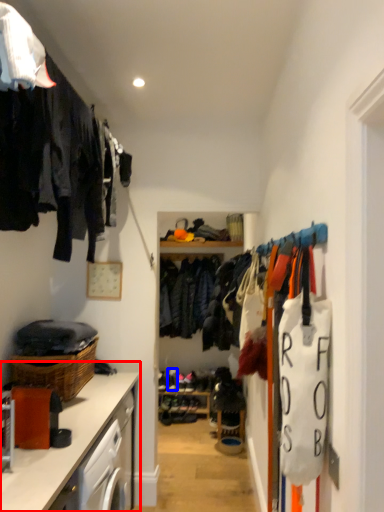
Question: Among these objects, which one is farthest to the camera, countertop (highlighted by a red box) or shoe (highlighted by a blue box)?

Choices:
 (A) countertop
 (B) shoe

Answer: (B)